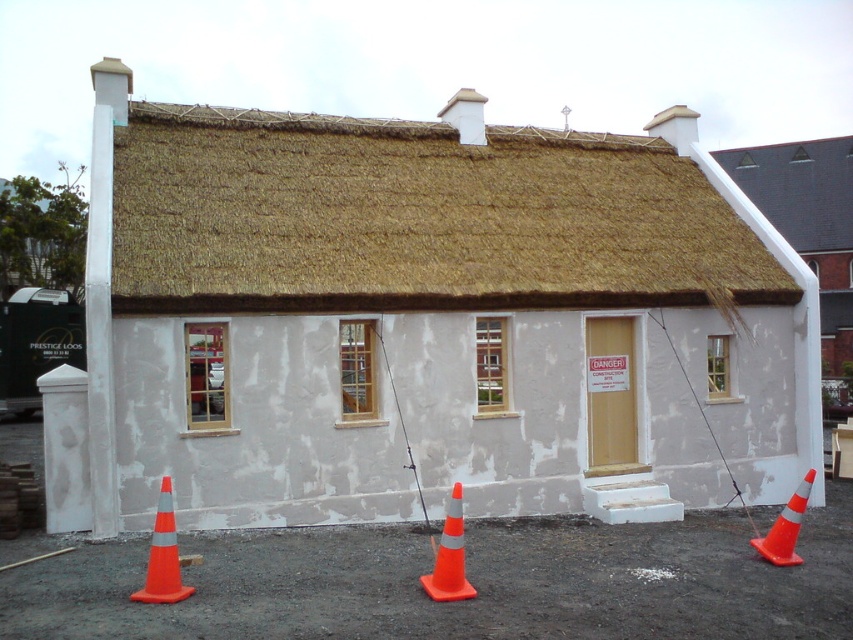
Question: Which point is farther from the camera taking this photo?

Choices:
 (A) (709, 433)
 (B) (599, 420)

Answer: (A)

Question: Is brown thatch at center bigger than orange/cone at lower center?

Choices:
 (A) no
 (B) yes

Answer: (B)

Question: Can you confirm if brown thatch at center is thinner than orange reflective cone at lower right?

Choices:
 (A) no
 (B) yes

Answer: (A)

Question: Based on their relative distances, which object is nearer to the orange/cone at lower center?

Choices:
 (A) white plastered hut at center
 (B) wooden fishing pole at center

Answer: (B)

Question: Which point is farther to the camera?

Choices:
 (A) orange/cone at lower center
 (B) orange/cone at lower left
 (C) brown thatch at center
 (D) orange reflective cone at lower right

Answer: (C)

Question: Is brown thatch at center above orange plastic fishing pole at right?

Choices:
 (A) no
 (B) yes

Answer: (B)